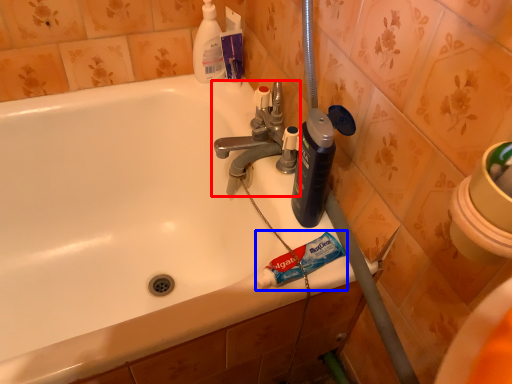
Question: Which point is further to the camera, tap (highlighted by a red box) or toothpaste (highlighted by a blue box)?

Choices:
 (A) tap
 (B) toothpaste

Answer: (A)